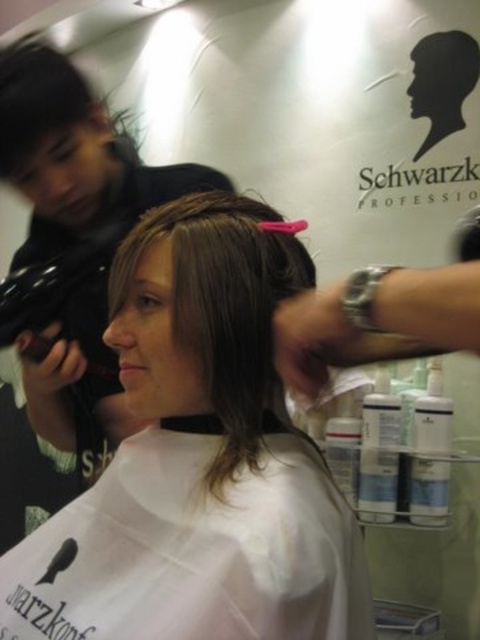
You are a stylist working in the salon. You need to adjust the position of the brown matte hair clip at center so it doesn not obstruct the view of the smooth brown hair at center. Can you move the clip to the side without touching the hair?

The smooth brown hair at center is currently in front of the brown matte hair clip at center. To avoid obstructing the view, you can move the brown matte hair clip at center to the side without touching the hair, as it is behind the hair strands.

You are standing in the hair salon and want to place a decorative vase exactly at the point marked as point (168, 408). If the vase is 50 centimeters tall, will it be visible to someone sitting in the stylist chair?

The point (168, 408) is 72.04 centimeters away from the viewer. Since the vase is only 50 centimeters tall, it will not reach the height needed to be seen from the stylist chair, so it would be hidden from view.

You are a customer in the hair salon and want to check if the pink plastic comb at upper center is visible to you while looking at the smooth brown hair at center. Can you see it?

The pink plastic comb at upper center is behind the smooth brown hair at center, so it is not visible to you while looking at the smooth brown hair at center.